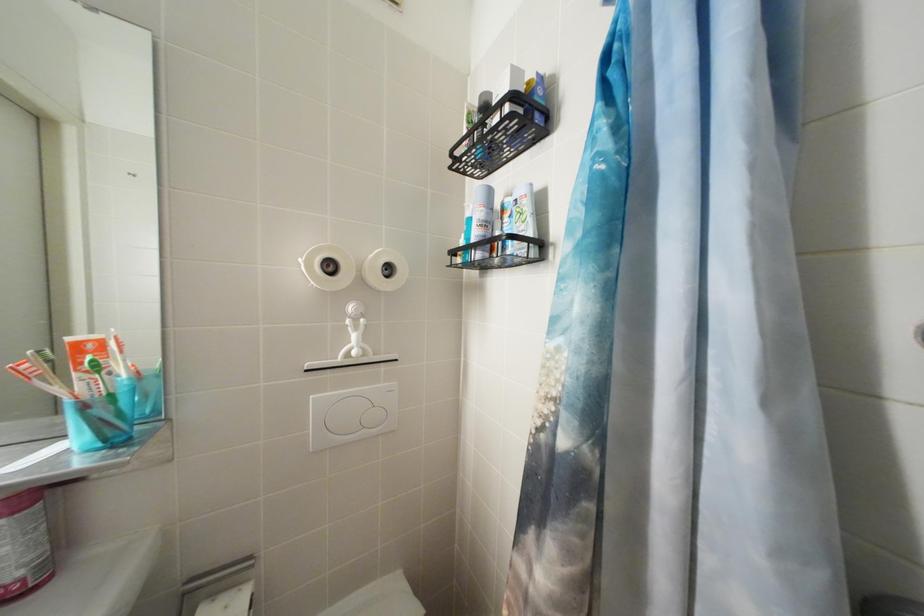
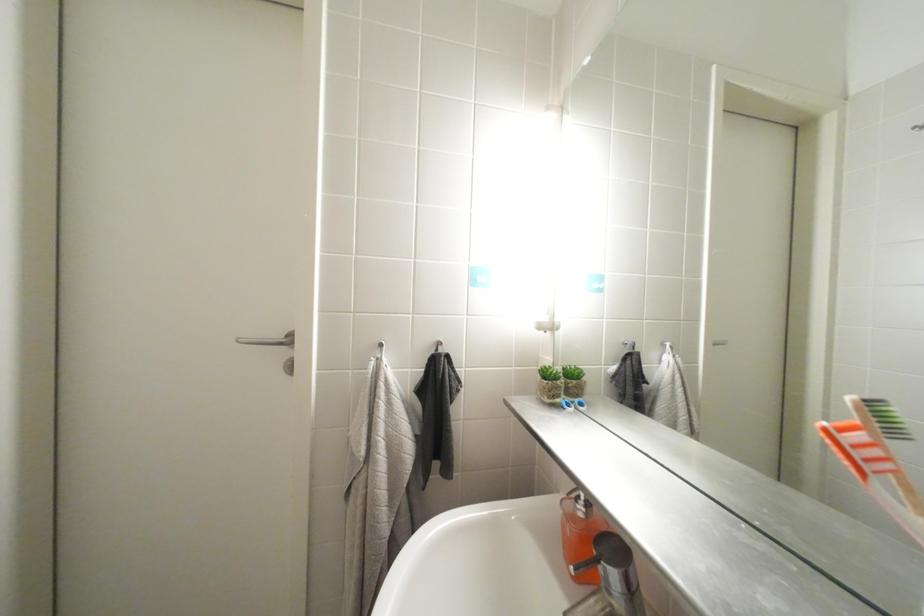
Question: How did the camera likely rotate?

Choices:
 (A) Left
 (B) Right
 (C) Up
 (D) Down

Answer: (A)